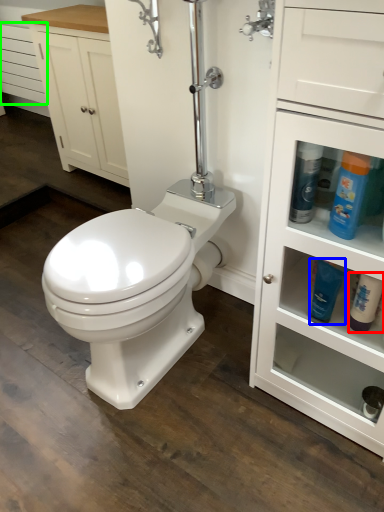
Question: Which is nearer to the cleaning product (highlighted by a red box)? cleaning product (highlighted by a blue box) or drawer (highlighted by a green box).

Choices:
 (A) cleaning product
 (B) drawer

Answer: (A)